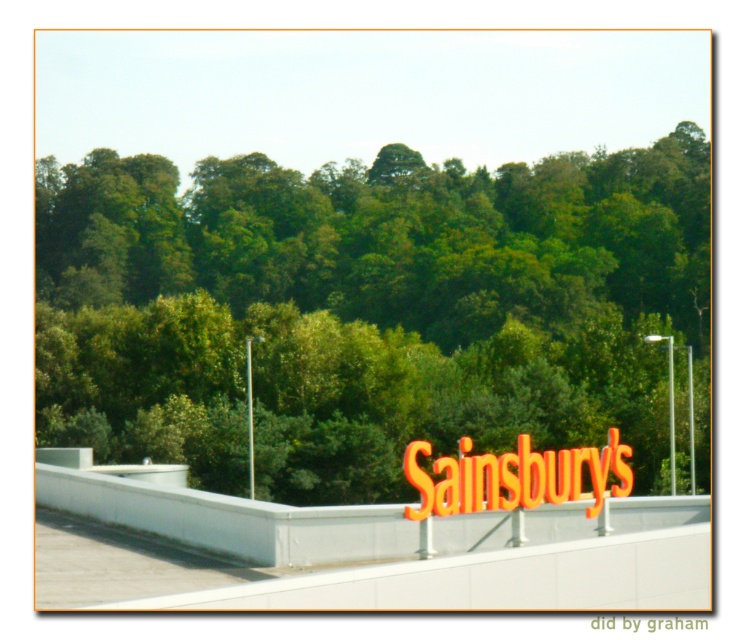
Question: Which point is closer to the camera taking this photo?

Choices:
 (A) (377, 604)
 (B) (580, 480)
 (C) (236, 266)
 (D) (651, 625)

Answer: (A)

Question: Which point is closer to the camera?

Choices:
 (A) (674, 627)
 (B) (184, 492)

Answer: (A)

Question: Does green leafy tree at upper center come behind white matte overpass at center?

Choices:
 (A) yes
 (B) no

Answer: (A)

Question: Can you confirm if white matte overpass at center is smaller than orange metallic sainsbury's sign at center?

Choices:
 (A) no
 (B) yes

Answer: (A)

Question: Is white matte overpass at center to the right of orange plastic sign at center from the viewer's perspective?

Choices:
 (A) yes
 (B) no

Answer: (B)

Question: Among these points, which one is nearest to the camera?

Choices:
 (A) (656, 294)
 (B) (131, 492)

Answer: (B)